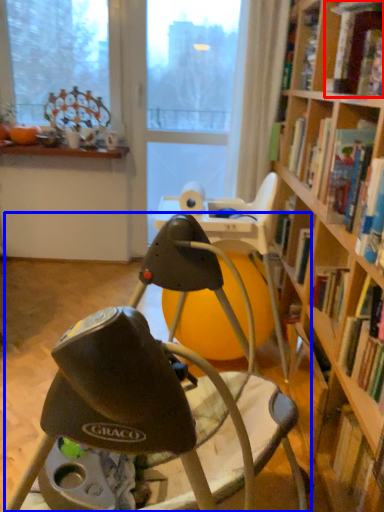
Question: Among these objects, which one is nearest to the camera, book (highlighted by a red box) or chair (highlighted by a blue box)?

Choices:
 (A) book
 (B) chair

Answer: (B)